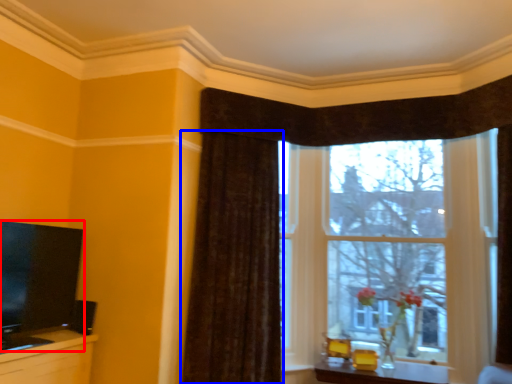
Question: Which of the following is the farthest to the observer, television (highlighted by a red box) or curtain (highlighted by a blue box)?

Choices:
 (A) television
 (B) curtain

Answer: (B)